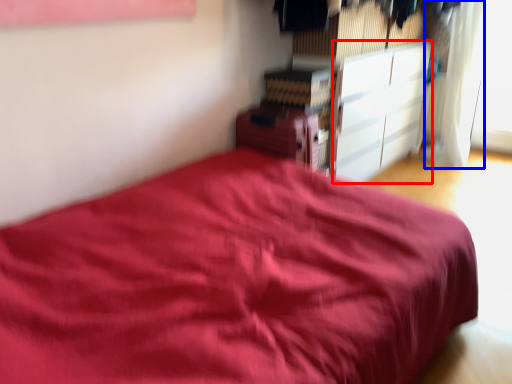
Question: Which object is closer to the camera taking this photo, cabinetry (highlighted by a red box) or curtain (highlighted by a blue box)?

Choices:
 (A) cabinetry
 (B) curtain

Answer: (A)